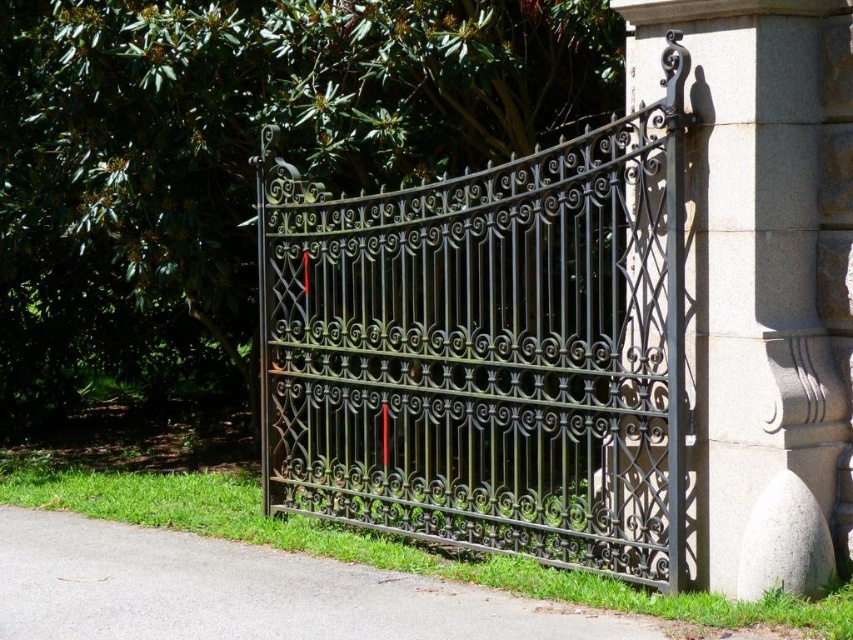
Can you confirm if black wrought iron gate at center is positioned to the left of gray stone pillar at center right?

Yes, black wrought iron gate at center is to the left of gray stone pillar at center right.

Is black wrought iron gate at center above gray stone pillar at center right?

No, black wrought iron gate at center is not above gray stone pillar at center right.

Is point (473, 252) positioned before point (843, 234)?

No, (473, 252) is behind (843, 234).

Image resolution: width=853 pixels, height=640 pixels. In order to click on black wrought iron gate at center in this screenshot , I will do `click(488, 348)`.